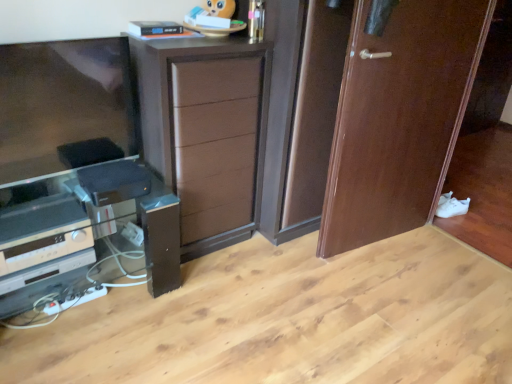
Question: Considering the positions of point (167, 99) and point (438, 4), is point (167, 99) closer or farther from the camera than point (438, 4)?

Choices:
 (A) farther
 (B) closer

Answer: (B)

Question: Do you think brown wood chest of drawers at center is within wooden door at right, or outside of it?

Choices:
 (A) outside
 (B) inside

Answer: (A)

Question: Based on their relative distances, which object is nearer to the wooden door at right?

Choices:
 (A) brown wood chest of drawers at center
 (B) silver metallic stereo at lower left
 (C) white matte shoe at lower right
 (D) black glossy speaker at lower left

Answer: (A)

Question: Considering the real-world distances, which object is farthest from the white matte shoe at lower right?

Choices:
 (A) silver metallic stereo at lower left
 (B) black glossy speaker at lower left
 (C) wooden door at right
 (D) brown wood chest of drawers at center

Answer: (A)